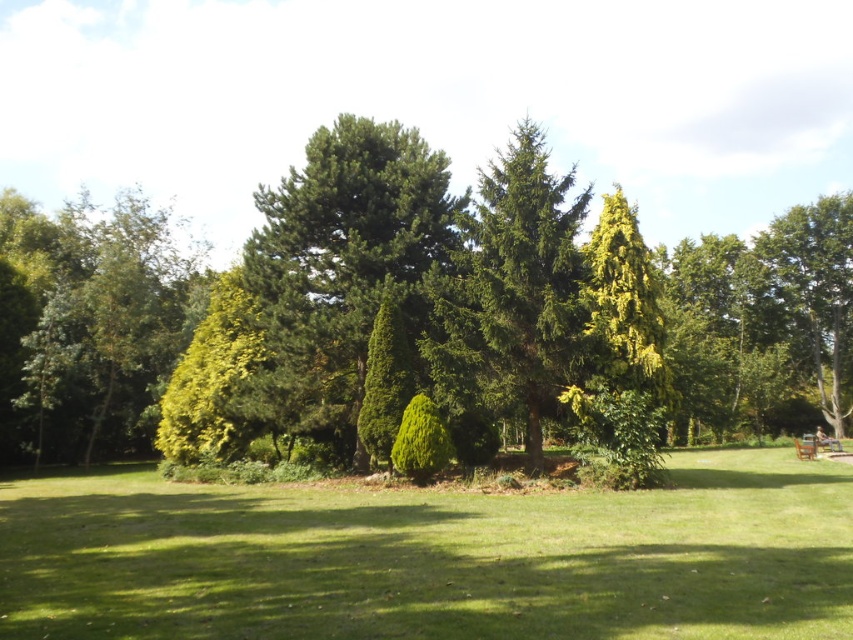
Question: Does green needle-like at center have a greater width compared to green textured tree at center?

Choices:
 (A) no
 (B) yes

Answer: (A)

Question: Does green textured tree at center have a larger size compared to green leafy tree at right?

Choices:
 (A) yes
 (B) no

Answer: (A)

Question: Which of the following is the closest to the observer?

Choices:
 (A) green leafy tree at right
 (B) green leafy shrubs at center
 (C) green leafy tree at left
 (D) green leafy tree at center

Answer: (B)

Question: Can you confirm if green leafy tree at left is thinner than green textured tree at center?

Choices:
 (A) no
 (B) yes

Answer: (A)

Question: Which of the following is the farthest from the observer?

Choices:
 (A) (374, 120)
 (B) (491, 332)
 (C) (288, 308)

Answer: (A)

Question: Estimate the real-world distances between objects in this image. Which object is closer to the green textured tree at center?

Choices:
 (A) green leafy shrubs at center
 (B) green needle-like at center

Answer: (A)